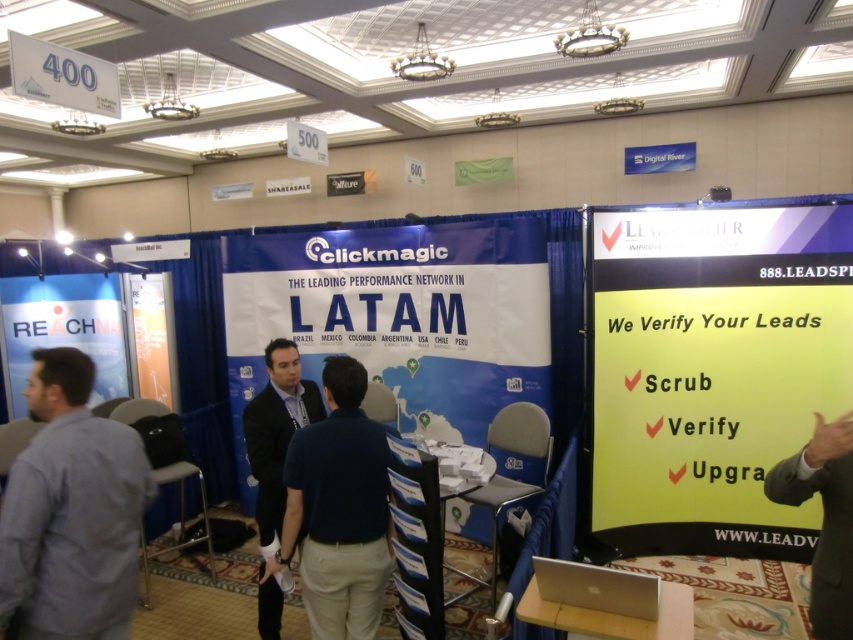
Question: Which point is farther from the camera taking this photo?

Choices:
 (A) (724, 300)
 (B) (262, 467)
 (C) (129, 612)

Answer: (A)

Question: Can you confirm if yellow paperboard at right is thinner than gray shirt at left?

Choices:
 (A) no
 (B) yes

Answer: (A)

Question: Does dark blue shirt at center appear under slate gray suit at right?

Choices:
 (A) no
 (B) yes

Answer: (B)

Question: Based on their relative distances, which object is nearer to the dark blue shirt at center?

Choices:
 (A) slate gray suit at right
 (B) yellow paperboard at right

Answer: (A)

Question: Can you confirm if yellow paperboard at right is positioned to the left of slate gray suit at right?

Choices:
 (A) yes
 (B) no

Answer: (B)

Question: Which object is positioned closest to the dark blue shirt at center?

Choices:
 (A) yellow paperboard at right
 (B) gray shirt at left
 (C) slate gray suit at right

Answer: (B)